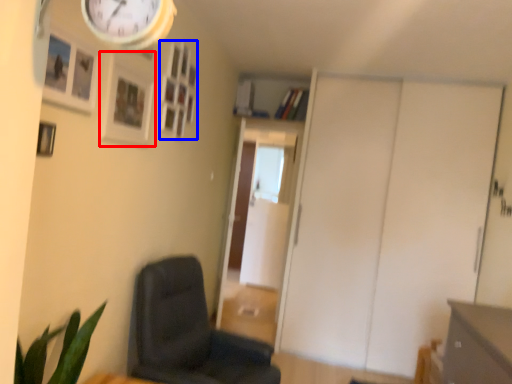
Question: Which point is closer to the camera, picture frame (highlighted by a red box) or picture frame (highlighted by a blue box)?

Choices:
 (A) picture frame
 (B) picture frame

Answer: (A)